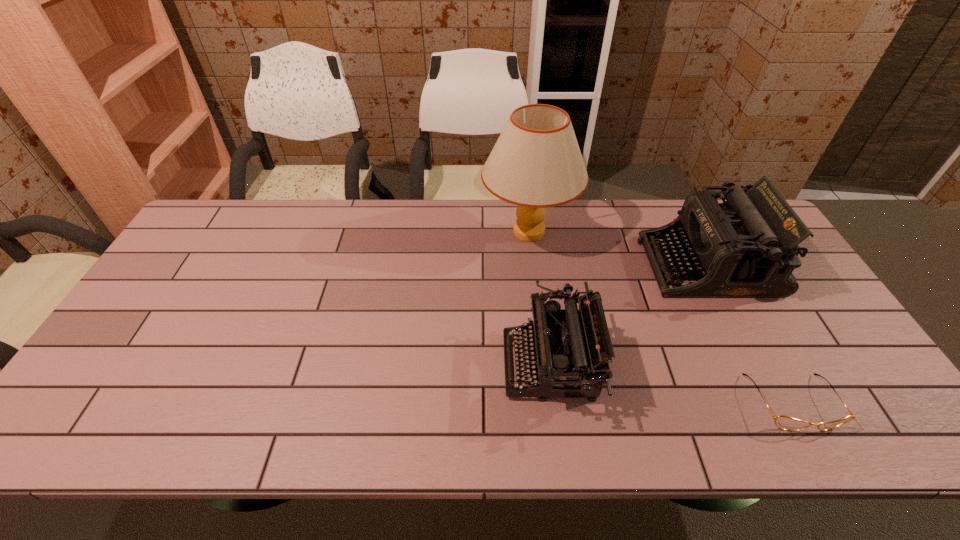
What are the coordinates of `the tallest object` in the screenshot? It's located at (536, 163).

This screenshot has height=540, width=960. I want to click on the right typewriter, so click(747, 247).

At what (x,y) coordinates should I click in order to perform the action: click on the farther typewriter. Please return your answer as a coordinate pair (x, y). This screenshot has width=960, height=540. Looking at the image, I should click on (747, 247).

Image resolution: width=960 pixels, height=540 pixels. Find the location of `the nearer typewriter`. the nearer typewriter is located at coordinates (570, 349).

The width and height of the screenshot is (960, 540). In order to click on the second shortest object in this screenshot , I will do `click(570, 349)`.

Find the location of a particular element. The width and height of the screenshot is (960, 540). spectacles is located at coordinates (783, 422).

I want to click on vacant position located 0.130m on the left of the lampshade, so click(442, 232).

Identify the location of free region located 0.310m on the keyboard of the farther typewriter. This screenshot has height=540, width=960. (543, 265).

Identify the location of free location located 0.240m on the keyboard of the farther typewriter. (566, 265).

Where is `vacant space situated 0.210m on the keyboard of the farther typewriter`? vacant space situated 0.210m on the keyboard of the farther typewriter is located at coordinates (576, 265).